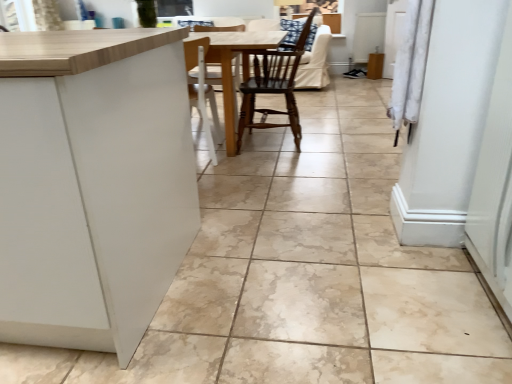
Question: From a real-world perspective, is wooden chair at center physically located above or below wooden table at center?

Choices:
 (A) above
 (B) below

Answer: (A)

Question: Relative to wooden table at center, is wooden chair at center in front or behind?

Choices:
 (A) behind
 (B) front

Answer: (A)

Question: Is wooden chair at center taller or shorter than wooden table at center?

Choices:
 (A) short
 (B) tall

Answer: (B)

Question: Would you say wooden table at center is inside or outside wooden chair at center?

Choices:
 (A) outside
 (B) inside

Answer: (A)

Question: Is wooden table at center to the left or to the right of wooden chair at center in the image?

Choices:
 (A) right
 (B) left

Answer: (B)

Question: Looking at their shapes, would you say wooden table at center is wider or thinner than wooden chair at center?

Choices:
 (A) thin
 (B) wide

Answer: (B)

Question: Does point (214, 34) appear closer or farther from the camera than point (266, 112)?

Choices:
 (A) farther
 (B) closer

Answer: (B)